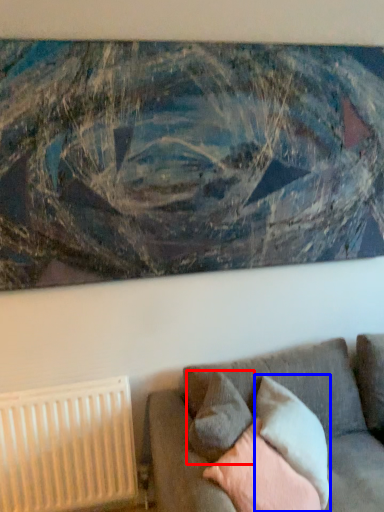
Question: Which point is further to the camera, pillow (highlighted by a red box) or pillow (highlighted by a blue box)?

Choices:
 (A) pillow
 (B) pillow

Answer: (B)